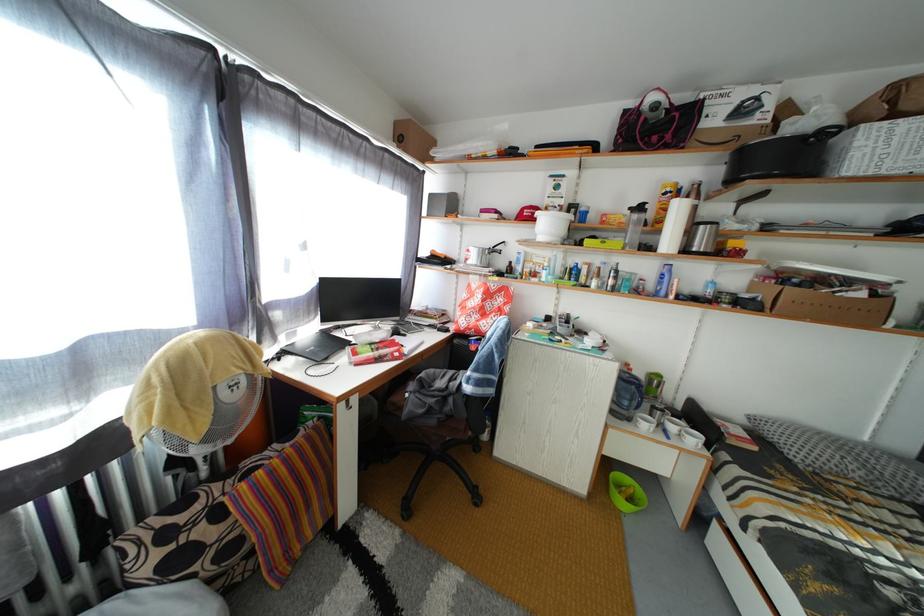
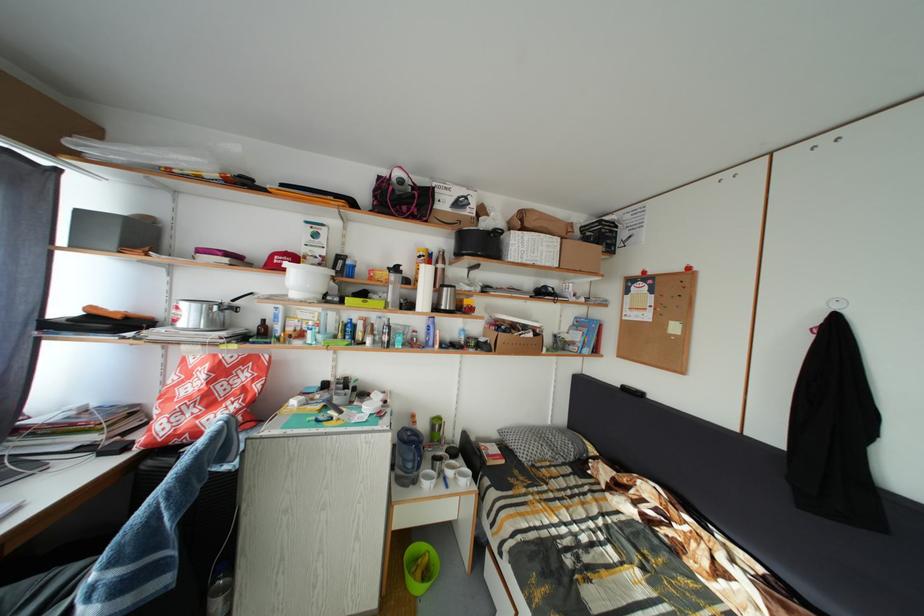
The point at (638, 426) is marked in the first image. Where is the corresponding point in the second image?

(423, 488)